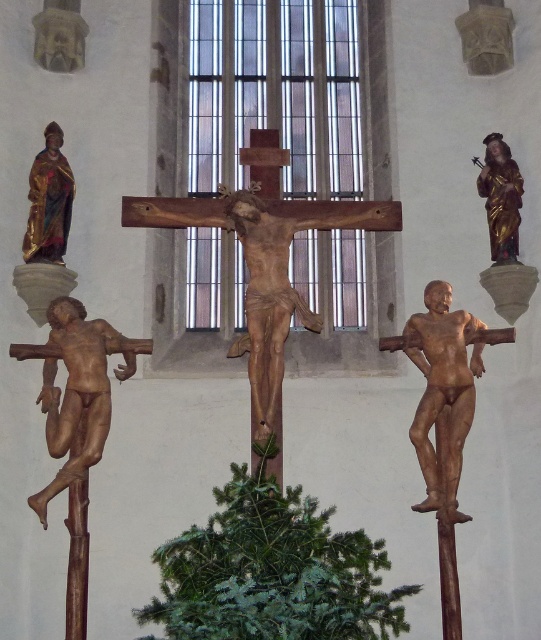
Which of these two, wooden crucifix at center or gold-painted wood statue at upper left, stands taller?

wooden crucifix at center is taller.

I want to click on wooden crucifix at center, so click(x=338, y=212).

Is point (230, 225) farther from viewer compared to point (69, 220)?

No.

The width and height of the screenshot is (541, 640). I want to click on wooden crucifix at center, so click(338, 212).

Does brown wood crucifix at left have a smaller size compared to gold-painted wood statue at upper right?

Actually, brown wood crucifix at left might be larger than gold-painted wood statue at upper right.

Between point (95, 440) and point (504, 177), which one is positioned in front?

Point (95, 440)

The width and height of the screenshot is (541, 640). Find the location of `brown wood crucifix at left`. brown wood crucifix at left is located at coordinates (77, 388).

Which is more to the left, brown wooden crucifix at right or gold-painted wood statue at upper left?

From the viewer's perspective, gold-painted wood statue at upper left appears more on the left side.

Can you confirm if brown wooden crucifix at right is positioned to the right of gold-painted wood statue at upper left?

Correct, you'll find brown wooden crucifix at right to the right of gold-painted wood statue at upper left.

Where is `brown wooden crucifix at right`? Image resolution: width=541 pixels, height=640 pixels. brown wooden crucifix at right is located at coordinates (444, 388).